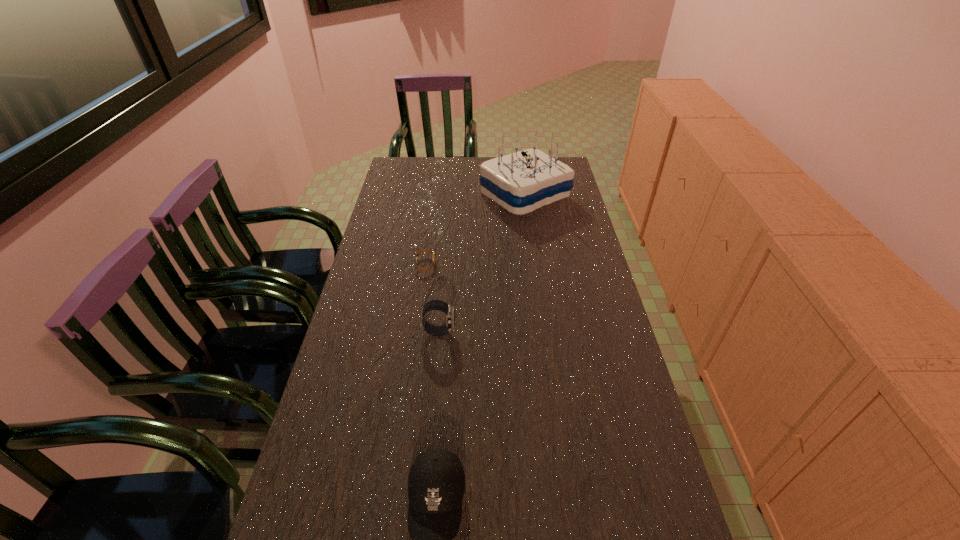
At what (x,y) coordinates should I click in order to perform the action: click on the tallest object. Please return your answer as a coordinate pair (x, y). This screenshot has height=540, width=960. Looking at the image, I should click on (520, 182).

The height and width of the screenshot is (540, 960). Identify the location of the farthest object. (520, 182).

Locate an element on the screen. This screenshot has width=960, height=540. the second nearest object is located at coordinates (440, 305).

This screenshot has width=960, height=540. Find the location of `the taller watch`. the taller watch is located at coordinates (440, 305).

Where is `the second farthest object`? the second farthest object is located at coordinates (425, 250).

At what (x,y) coordinates should I click in order to perform the action: click on the shorter watch. Please return your answer as a coordinate pair (x, y). This screenshot has height=540, width=960. Looking at the image, I should click on (425, 250).

Where is `free space located on the back of the rightmost object`? free space located on the back of the rightmost object is located at coordinates (520, 165).

In order to click on free space located on the face of the nearer watch in this screenshot , I will do `click(595, 332)`.

You are a GUI agent. You are given a task and a screenshot of the screen. Output one action in this format:
    pyautogui.click(x=<x>, y=<y>)
    Task: Click on the free location located 0.110m on the face of the farther watch
    This screenshot has width=960, height=540.
    Given the screenshot: What is the action you would take?
    pyautogui.click(x=469, y=265)

You are a GUI agent. You are given a task and a screenshot of the screen. Output one action in this format:
    pyautogui.click(x=<x>, y=<y>)
    Task: Click on the object that is at the far edge
    
    Given the screenshot: What is the action you would take?
    click(x=520, y=182)